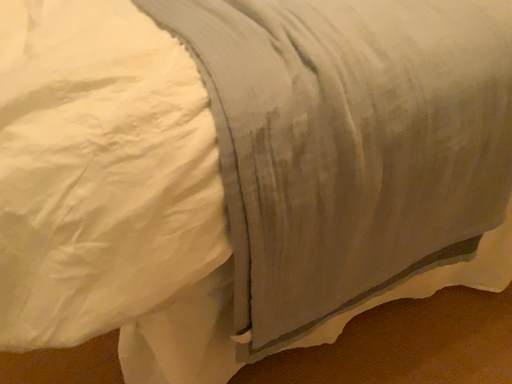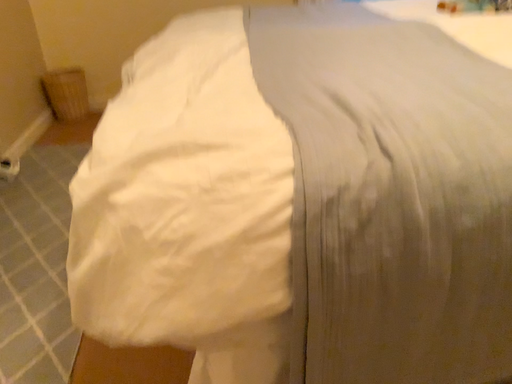
Question: Which way did the camera rotate in the video?

Choices:
 (A) rotated right
 (B) rotated left

Answer: (B)